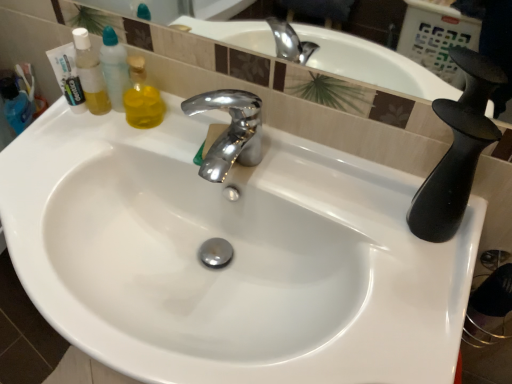
Find the location of a particular element. vacant area that lies between translucent plastic mouthwash at left and polished chrome faucet at center is located at coordinates (163, 135).